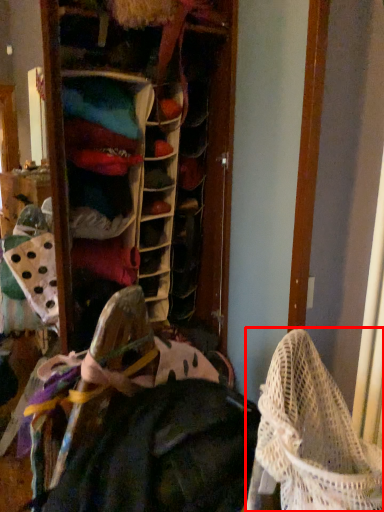
Question: Considering the relative positions of baby carriage (annotated by the red box) and clothing in the image provided, where is baby carriage (annotated by the red box) located with respect to the staircase?

Choices:
 (A) right
 (B) left

Answer: (A)